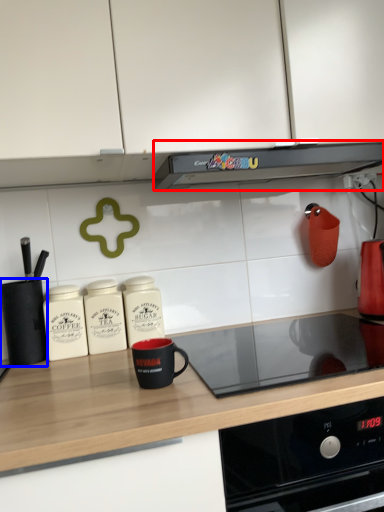
Question: Which of the following is the farthest to the observer, kitchen appliance (highlighted by a red box) or kitchen appliance (highlighted by a blue box)?

Choices:
 (A) kitchen appliance
 (B) kitchen appliance

Answer: (B)